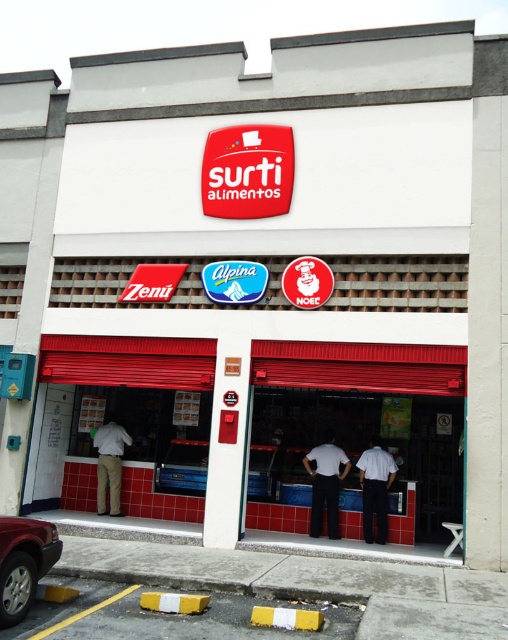
Question: Can you confirm if silver metallic car at lower left is positioned to the right of white uniform at center?

Choices:
 (A) yes
 (B) no

Answer: (B)

Question: Among these objects, which one is nearest to the camera?

Choices:
 (A) white matte shirt at center
 (B) khaki pants at center
 (C) silver metallic car at lower left
 (D) white uniform at center

Answer: (C)

Question: Is silver metallic car at lower left positioned before khaki pants at center?

Choices:
 (A) no
 (B) yes

Answer: (B)

Question: Estimate the real-world distances between objects in this image. Which object is closer to the silver metallic car at lower left?

Choices:
 (A) khaki pants at center
 (B) white matte shirt at center
 (C) white uniform at center

Answer: (A)

Question: Which object is positioned closest to the white uniform at center?

Choices:
 (A) silver metallic car at lower left
 (B) khaki pants at center
 (C) white matte shirt at center

Answer: (C)

Question: Can you confirm if silver metallic car at lower left is positioned to the left of white uniform at center?

Choices:
 (A) yes
 (B) no

Answer: (A)